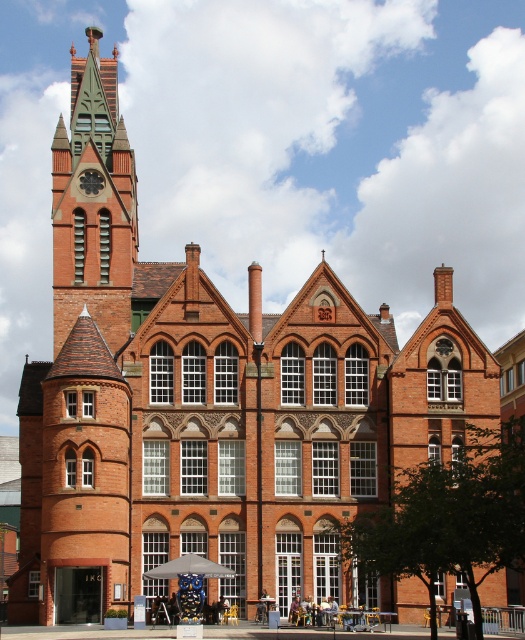
Between point (79, 276) and point (200, 595), which one is positioned in front?

Point (200, 595)

Between green glass clock tower at upper left and gray fabric umbrella at center, which one is positioned lower?

Positioned lower is gray fabric umbrella at center.

Who is more distant from viewer, [60,129] or [196,609]?

Point [60,129]

Locate an element on the screen. green glass clock tower at upper left is located at coordinates (93, 202).